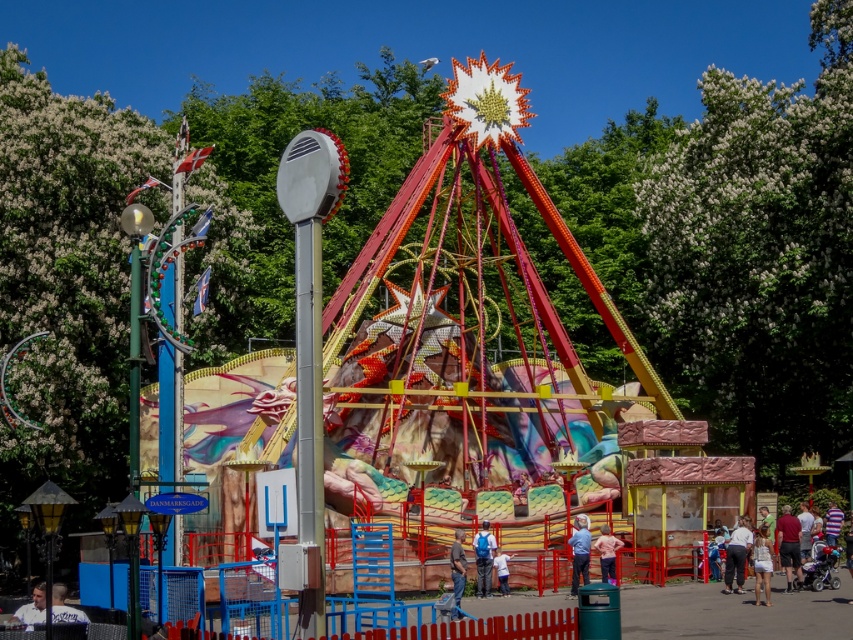
Question: Can you confirm if white cotton shirt at lower right is bigger than white cotton shirt at center?

Choices:
 (A) yes
 (B) no

Answer: (A)

Question: Which point is farther to the camera?

Choices:
 (A) white cotton dress at center
 (B) light brown leather jacket at lower left
 (C) blue denim jeans at center
 (D) light blue shirt at center

Answer: (C)

Question: Can you confirm if white cotton shirt at lower right is positioned to the right of light brown leather jacket at lower left?

Choices:
 (A) yes
 (B) no

Answer: (A)

Question: Does white cotton shirt at lower right lie in front of light blue shirt at center?

Choices:
 (A) no
 (B) yes

Answer: (B)

Question: Estimate the real-world distances between objects in this image. Which object is farther from the blue denim jeans at center?

Choices:
 (A) light brown leather jacket at lower left
 (B) white cotton dress at center
 (C) brown leather jacket at center
 (D) white cotton shirt at center

Answer: (A)

Question: Which of the following is the closest to the observer?

Choices:
 (A) white cotton shirt at center
 (B) blue denim jeans at center
 (C) light blue shirt at center
 (D) white cotton shirt at lower right

Answer: (D)